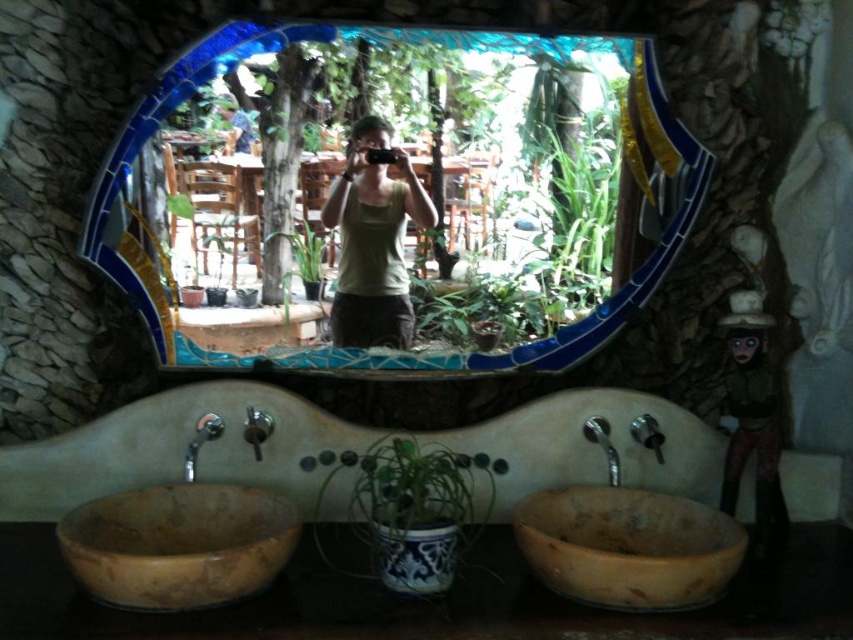
You are standing in the bathroom and want to place a decorative item between the blue mosaic mirror at center and the natural wood sink at lower left. Based on their positions, which side of the mirror should you place it on to keep it aligned with the sink?

You should place the decorative item to the left side of the blue mosaic mirror at center because the natural wood sink at lower left is positioned to its left, so aligning the item there maintains the spatial relationship between them.

You are organizing a small shelf in the bathroom and need to place the green matte tank top at center and the wooden figurine at right. If the shelf has a width of 20 cm, which item might not fit if placed alone?

The green matte tank top at center has a larger width than the wooden figurine at right, so the green matte tank top at center might not fit on the 20 cm wide shelf if placed alone.